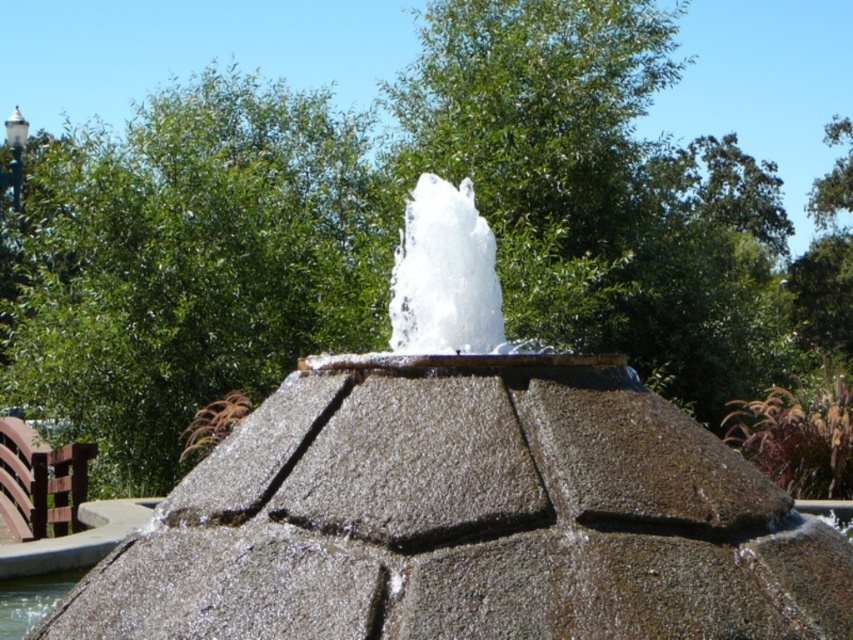
Is white frothy water at center to the left of clear water at fountain center from the viewer's perspective?

In fact, white frothy water at center is to the right of clear water at fountain center.

The width and height of the screenshot is (853, 640). In order to click on white frothy water at center in this screenshot , I will do `click(444, 275)`.

Can you confirm if gray stone fountain at center is smaller than clear water at fountain center?

No, gray stone fountain at center is not smaller than clear water at fountain center.

Looking at this image, between gray stone fountain at center and clear water at fountain center, which one appears on the left side from the viewer's perspective?

Positioned to the left is clear water at fountain center.

Consider the image. Measure the distance between gray stone fountain at center and camera.

gray stone fountain at center and camera are 10.05 feet apart from each other.

This screenshot has width=853, height=640. Identify the location of gray stone fountain at center. (465, 497).

Is gray stone fountain at center below white frothy water at center?

Yes.

Is gray stone fountain at center shorter than white frothy water at center?

No, gray stone fountain at center is not shorter than white frothy water at center.

Locate an element on the screen. gray stone fountain at center is located at coordinates (465, 497).